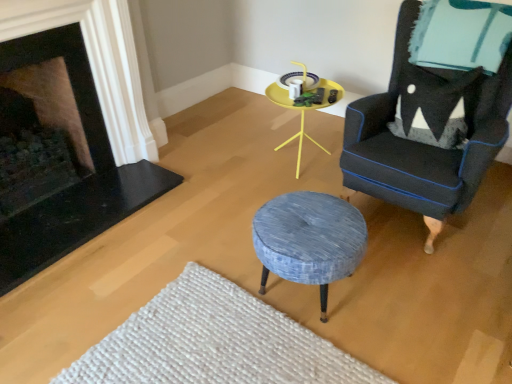
Question: In the image, is velvet dark blue armchair at right positioned in front of or behind black stone fireplace at left, arranged as the second fireplace when viewed from the right?

Choices:
 (A) behind
 (B) front

Answer: (B)

Question: In terms of height, does velvet dark blue armchair at right look taller or shorter compared to black stone fireplace at left, acting as the first fireplace starting from the left?

Choices:
 (A) short
 (B) tall

Answer: (B)

Question: Which object is positioned closest to the black stone fireplace at left, which is the 2th fireplace from left to right?

Choices:
 (A) black stone fireplace at left, acting as the first fireplace starting from the left
 (B) textured blue fabric stool at center
 (C) velvet dark blue armchair at right
 (D) yellow plastic table at center
 (E) white textured rug at lower center

Answer: (A)

Question: Which object is the farthest from the black stone fireplace at left, which is the 2th fireplace from left to right?

Choices:
 (A) velvet dark blue armchair at right
 (B) black stone fireplace at left, arranged as the second fireplace when viewed from the right
 (C) yellow plastic table at center
 (D) textured blue fabric stool at center
 (E) white textured rug at lower center

Answer: (A)